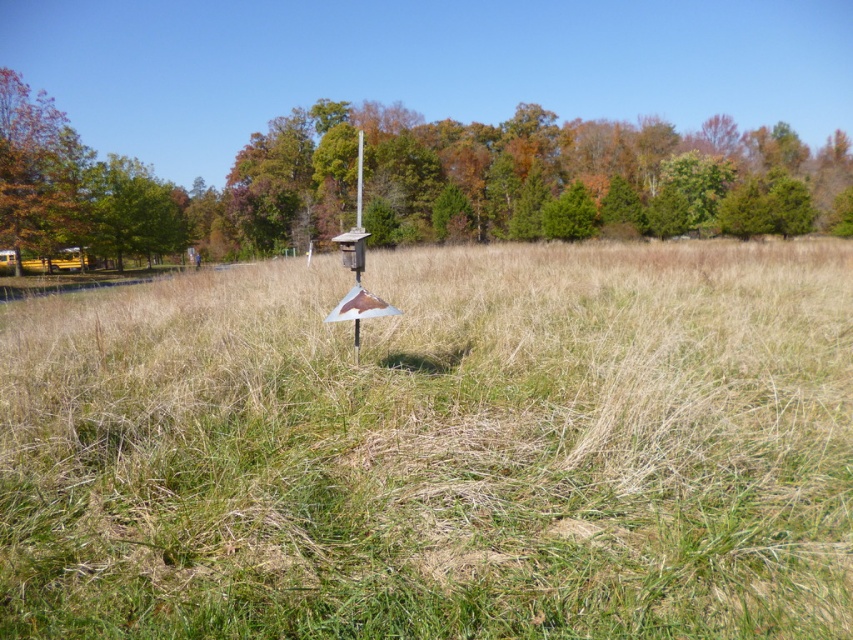
Which is below, metallic silver sign at center or green matte tree at upper center?

metallic silver sign at center

Which is behind, point (322, 573) or point (485, 193)?

The point (485, 193) is behind.

In order to click on metallic silver sign at center in this screenshot , I will do `click(438, 449)`.